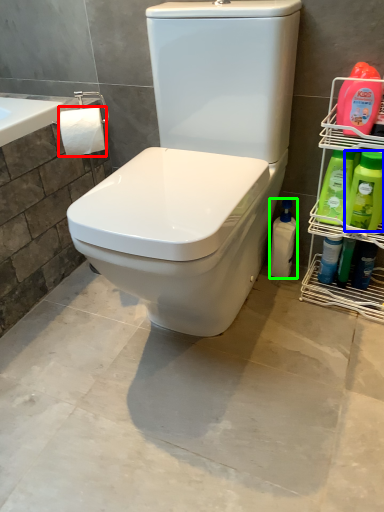
Question: Estimate the real-world distances between objects in this image. Which object is farther from toilet paper (highlighted by a red box), cleaning product (highlighted by a blue box) or cleaning product (highlighted by a green box)?

Choices:
 (A) cleaning product
 (B) cleaning product

Answer: (A)